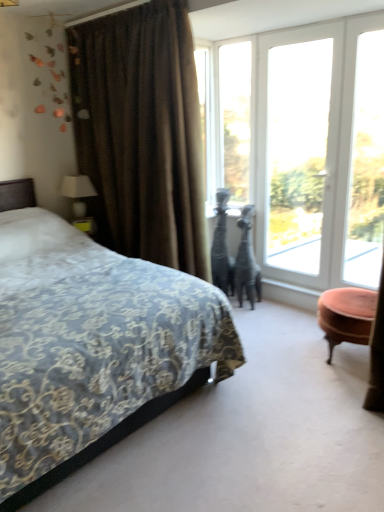
Question: From a real-world perspective, is velvet pink ottoman at right physically above white fabric lampshade at left?

Choices:
 (A) no
 (B) yes

Answer: (A)

Question: Is velvet pink ottoman at right at the right side of white fabric lampshade at left?

Choices:
 (A) yes
 (B) no

Answer: (A)

Question: Can we say velvet pink ottoman at right lies outside white fabric lampshade at left?

Choices:
 (A) yes
 (B) no

Answer: (A)

Question: Are velvet pink ottoman at right and white fabric lampshade at left located far from each other?

Choices:
 (A) no
 (B) yes

Answer: (B)

Question: From a real-world perspective, is velvet pink ottoman at right under white fabric lampshade at left?

Choices:
 (A) no
 (B) yes

Answer: (B)

Question: Is the position of velvet pink ottoman at right less distant than that of white fabric lampshade at left?

Choices:
 (A) yes
 (B) no

Answer: (A)

Question: From a real-world perspective, is white glass door at upper right, the fourth window viewed from the left, located beneath transparent glass window at upper right?

Choices:
 (A) yes
 (B) no

Answer: (B)

Question: Does white glass door at upper right, the fourth window viewed from the left, lie behind transparent glass window at upper right?

Choices:
 (A) no
 (B) yes

Answer: (B)

Question: Does white glass door at upper right, the fourth window viewed from the left, have a greater height compared to transparent glass window at upper right?

Choices:
 (A) no
 (B) yes

Answer: (B)

Question: Can you confirm if white glass door at upper right, placed as the 1th window when sorted from right to left, is bigger than transparent glass window at upper right?

Choices:
 (A) yes
 (B) no

Answer: (A)

Question: Considering the relative sizes of white glass door at upper right, the fourth window viewed from the left, and transparent glass window at upper right in the image provided, is white glass door at upper right, the fourth window viewed from the left, thinner than transparent glass window at upper right?

Choices:
 (A) yes
 (B) no

Answer: (A)

Question: Is white glass door at upper right, the fourth window viewed from the left, in front of transparent glass window at upper right?

Choices:
 (A) yes
 (B) no

Answer: (B)

Question: Is velvet-patterned bed at left located within transparent glass window at upper center, which is counted as the fourth window, starting from the right?

Choices:
 (A) no
 (B) yes

Answer: (A)